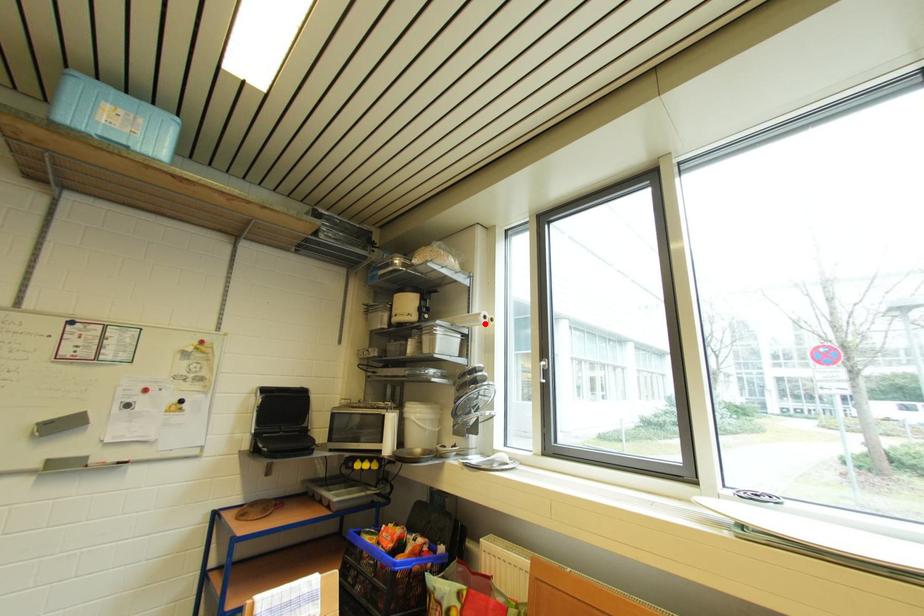
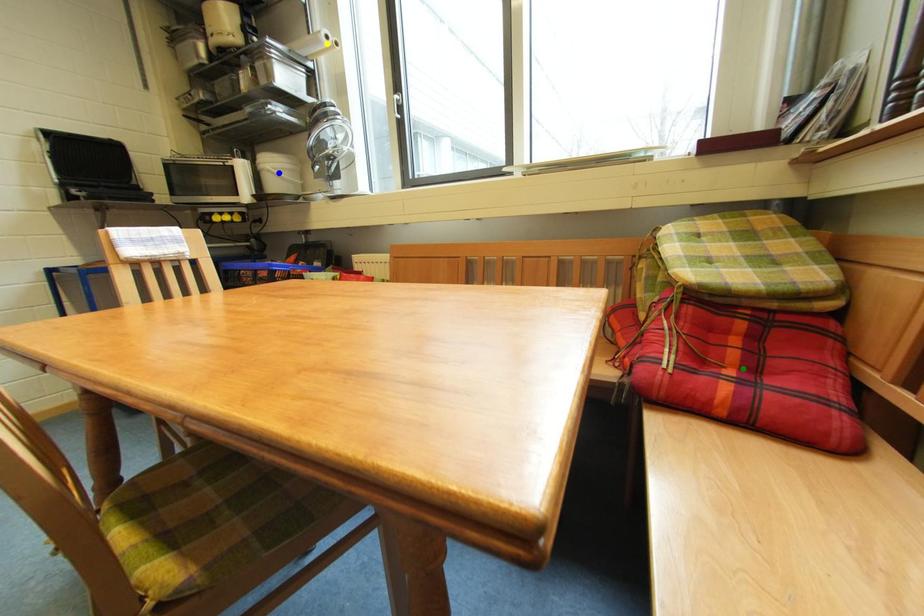
Question: I am providing you with two images of the same scene from different viewpoints. A red point is marked on the first image. You are given multiple points on the second image. Which spot in image 2 lines up with the point in image 1?

Choices:
 (A) green point
 (B) yellow point
 (C) blue point

Answer: (B)